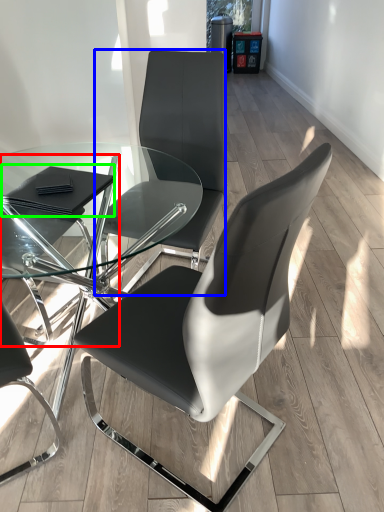
Question: Which object is positioned farthest from chair (highlighted by a red box)? Select from chair (highlighted by a blue box) and pad (highlighted by a green box).

Choices:
 (A) chair
 (B) pad

Answer: (A)